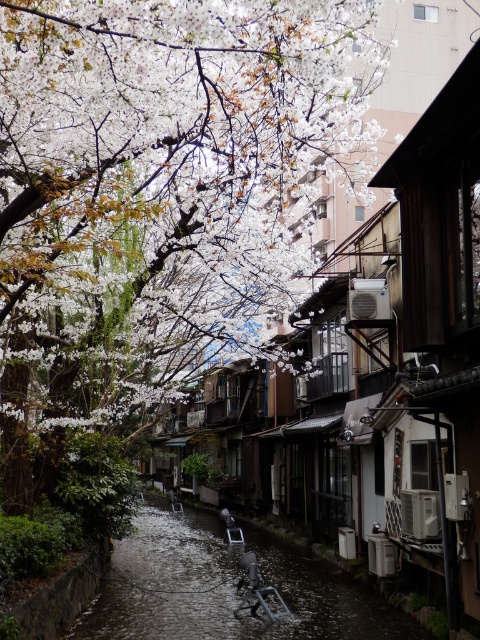
Is point (214, 253) in front of point (196, 636)?

No, (214, 253) is further to viewer.

Based on the photo, can you confirm if white blossoms at upper center is positioned to the right of dark gray concrete river at center?

Correct, you'll find white blossoms at upper center to the right of dark gray concrete river at center.

Is point (214, 257) closer to viewer compared to point (405, 625)?

No, it is behind (405, 625).

Identify the location of white blossoms at upper center. Image resolution: width=480 pixels, height=640 pixels. (156, 195).